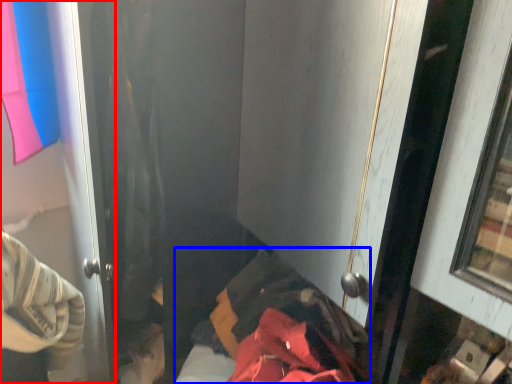
Question: Which of the following is the farthest to the observer, door (highlighted by a red box) or bed (highlighted by a blue box)?

Choices:
 (A) door
 (B) bed

Answer: (A)